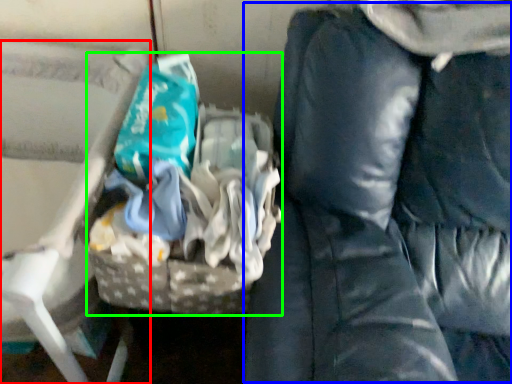
Question: Which object is the closest to the furniture (highlighted by a red box)? Choose among these: bean bag chair (highlighted by a blue box) or waste (highlighted by a green box).

Choices:
 (A) bean bag chair
 (B) waste

Answer: (B)